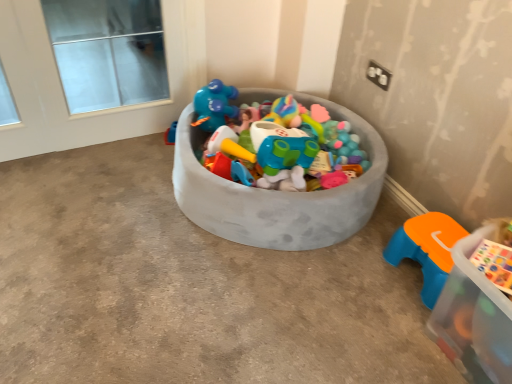
Measure the distance between orange plastic stool at lower right and camera.

They are 4.55 feet apart.

Locate an element on the screen. transparent plastic storage box at lower right, positioned as the second storage box in back-to-front order is located at coordinates (473, 318).

Between transparent plastic storage box at lower right, placed as the second storage box when sorted from left to right, and orange plastic stool at lower right, which one has larger size?

With larger size is transparent plastic storage box at lower right, placed as the second storage box when sorted from left to right.

From a real-world perspective, who is located higher, transparent plastic storage box at lower right, placed as the second storage box when sorted from left to right, or orange plastic stool at lower right?

From a 3D spatial view, transparent plastic storage box at lower right, placed as the second storage box when sorted from left to right, is above.

Which of these two, transparent plastic storage box at lower right, the 1th storage box positioned from the right, or orange plastic stool at lower right, is thinner?

orange plastic stool at lower right.

Which object is more forward, transparent plastic storage box at lower right, the 1th storage box positioned from the right, or orange plastic stool at lower right?

transparent plastic storage box at lower right, the 1th storage box positioned from the right.

Is white glass window at upper left next to orange plastic stool at lower right and touching it?

No, white glass window at upper left is not touching orange plastic stool at lower right.

Which is correct: white glass window at upper left is inside orange plastic stool at lower right, or outside of it?

white glass window at upper left is not inside orange plastic stool at lower right, it's outside.

In the scene shown: From their relative heights in the image, would you say white glass window at upper left is taller or shorter than orange plastic stool at lower right?

Considering their sizes, white glass window at upper left has more height than orange plastic stool at lower right.

What's the angular difference between white glass window at upper left and orange plastic stool at lower right's facing directions?

white glass window at upper left and orange plastic stool at lower right are facing 90.2 degrees away from each other.

Does point (269, 221) come farther from viewer compared to point (429, 215)?

No, (269, 221) is closer to viewer.

Could you tell me if textured gray bowl at center, the second storage box viewed from the right, is facing orange plastic stool at lower right?

No, textured gray bowl at center, the second storage box viewed from the right, is not oriented towards orange plastic stool at lower right.

Identify the location of toy on the right of textured gray bowl at center, which appears as the 2th storage box when viewed from the front. (426, 249).

Can you see textured gray bowl at center, the first storage box from the left, touching orange plastic stool at lower right?

There is a gap between textured gray bowl at center, the first storage box from the left, and orange plastic stool at lower right.

Identify the location of storage box that is the 1st one when counting forward from the white glass window at upper left. (277, 195).

From the image's perspective, between textured gray bowl at center, the first storage box from the left, and white glass window at upper left, who is located below?

textured gray bowl at center, the first storage box from the left, from the image's perspective.

From the picture: How distant is textured gray bowl at center, the first storage box from the left, from white glass window at upper left?

4.43 feet.

Is point (341, 210) positioned before point (52, 10)?

That is True.

In terms of size, does orange plastic stool at lower right appear bigger or smaller than white glass window at upper left?

In the image, orange plastic stool at lower right appears to be smaller than white glass window at upper left.

Looking at this image, considering the sizes of objects orange plastic stool at lower right and white glass window at upper left in the image provided, who is wider, orange plastic stool at lower right or white glass window at upper left?

With larger width is orange plastic stool at lower right.

Is orange plastic stool at lower right oriented away from white glass window at upper left?

No, orange plastic stool at lower right is not facing the opposite direction of white glass window at upper left.

Is orange plastic stool at lower right aimed at transparent plastic storage box at lower right, the 1th storage box positioned from the right?

No, orange plastic stool at lower right is not facing towards transparent plastic storage box at lower right, the 1th storage box positioned from the right.

Locate an element on the screen. This screenshot has width=512, height=384. storage box below the orange plastic stool at lower right (from the image's perspective) is located at coordinates (473, 318).

Is orange plastic stool at lower right wider than transparent plastic storage box at lower right, positioned as the second storage box in back-to-front order?

No.

Are transparent plastic storage box at lower right, placed as the second storage box when sorted from left to right, and textured gray bowl at center, placed as the first storage box when sorted from back to front, making contact?

No, transparent plastic storage box at lower right, placed as the second storage box when sorted from left to right, is not making contact with textured gray bowl at center, placed as the first storage box when sorted from back to front.

Which object is closer to the camera taking this photo, transparent plastic storage box at lower right, which ranks as the 1th storage box in front-to-back order, or textured gray bowl at center, which appears as the 2th storage box when viewed from the front?

transparent plastic storage box at lower right, which ranks as the 1th storage box in front-to-back order, is closer to the camera.

Considering the sizes of transparent plastic storage box at lower right, positioned as the second storage box in back-to-front order, and textured gray bowl at center, the second storage box viewed from the right, in the image, is transparent plastic storage box at lower right, positioned as the second storage box in back-to-front order, taller or shorter than textured gray bowl at center, the second storage box viewed from the right,?

Considering their sizes, transparent plastic storage box at lower right, positioned as the second storage box in back-to-front order, has less height than textured gray bowl at center, the second storage box viewed from the right.

From a real-world perspective, which object stands above the other?

transparent plastic storage box at lower right, positioned as the second storage box in back-to-front order, is physically above.

Which storage box is the 2nd one when counting from the front of the orange plastic stool at lower right? Please provide its 2D coordinates.

[(473, 318)]

I want to click on toy below the white glass window at upper left (from a real-world perspective), so click(x=426, y=249).

When comparing their distances from transparent plastic storage box at lower right, positioned as the second storage box in back-to-front order, does white glass window at upper left or orange plastic stool at lower right seem closer?

orange plastic stool at lower right is positioned closer to the anchor transparent plastic storage box at lower right, positioned as the second storage box in back-to-front order.

Which object lies nearer to the anchor point transparent plastic storage box at lower right, placed as the second storage box when sorted from left to right, textured gray bowl at center, placed as the first storage box when sorted from back to front, or white glass window at upper left?

Among the two, textured gray bowl at center, placed as the first storage box when sorted from back to front, is located nearer to transparent plastic storage box at lower right, placed as the second storage box when sorted from left to right.

Estimate the real-world distances between objects in this image. Which object is further from orange plastic stool at lower right, transparent plastic storage box at lower right, placed as the second storage box when sorted from left to right, or textured gray bowl at center, the first storage box from the left?

textured gray bowl at center, the first storage box from the left, is further to orange plastic stool at lower right.

Which object lies further to the anchor point textured gray bowl at center, the second storage box viewed from the right, orange plastic stool at lower right or white glass window at upper left?

The object further to textured gray bowl at center, the second storage box viewed from the right, is white glass window at upper left.

When comparing their distances from white glass window at upper left, does transparent plastic storage box at lower right, the 1th storage box positioned from the right, or textured gray bowl at center, the first storage box from the left, seem closer?

Among the two, textured gray bowl at center, the first storage box from the left, is located nearer to white glass window at upper left.

Based on their spatial positions, is transparent plastic storage box at lower right, the 1th storage box positioned from the right, or orange plastic stool at lower right closer to white glass window at upper left?

orange plastic stool at lower right is closer to white glass window at upper left.

Based on their spatial positions, is orange plastic stool at lower right or textured gray bowl at center, which appears as the 2th storage box when viewed from the front, further from white glass window at upper left?

orange plastic stool at lower right.

From the image, which object appears to be nearer to transparent plastic storage box at lower right, the 1th storage box positioned from the right, textured gray bowl at center, which appears as the 2th storage box when viewed from the front, or orange plastic stool at lower right?

The object closer to transparent plastic storage box at lower right, the 1th storage box positioned from the right, is orange plastic stool at lower right.

Locate an element on the screen. The image size is (512, 384). toy between white glass window at upper left and transparent plastic storage box at lower right, which ranks as the 1th storage box in front-to-back order, in the horizontal direction is located at coordinates (426, 249).

You are a GUI agent. You are given a task and a screenshot of the screen. Output one action in this format:
    pyautogui.click(x=<x>, y=<y>)
    Task: Click on the storage box between white glass window at upper left and transparent plastic storage box at lower right, which ranks as the 1th storage box in front-to-back order, from left to right
    
    Given the screenshot: What is the action you would take?
    pyautogui.click(x=277, y=195)

Identify the location of toy located between textured gray bowl at center, placed as the first storage box when sorted from back to front, and transparent plastic storage box at lower right, the 1th storage box positioned from the right, in the left-right direction. Image resolution: width=512 pixels, height=384 pixels. (426, 249).

You are a GUI agent. You are given a task and a screenshot of the screen. Output one action in this format:
    pyautogui.click(x=<x>, y=<y>)
    Task: Click on the storage box situated between white glass window at upper left and orange plastic stool at lower right from left to right
    The image size is (512, 384).
    Given the screenshot: What is the action you would take?
    pyautogui.click(x=277, y=195)